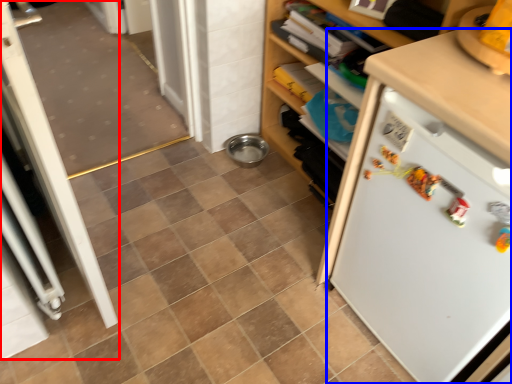
Question: Which point is further to the camera, screen door (highlighted by a red box) or refrigerator (highlighted by a blue box)?

Choices:
 (A) screen door
 (B) refrigerator

Answer: (A)